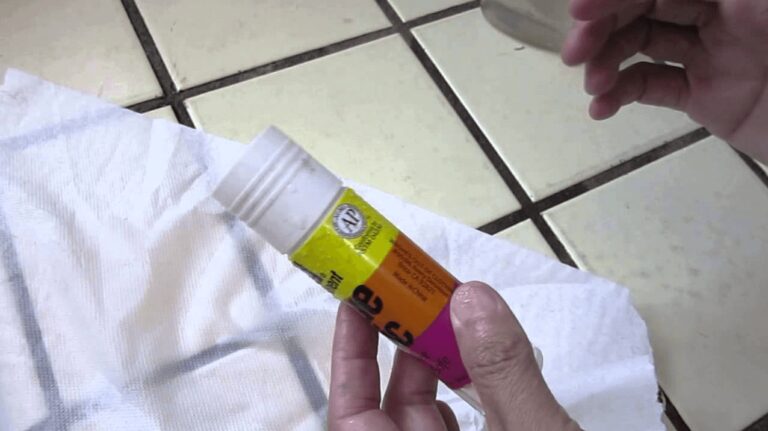
You are a GUI agent. You are given a task and a screenshot of the screen. Output one action in this format:
    pyautogui.click(x=<x>, y=<y>)
    Task: Click on the floor
    The height and width of the screenshot is (431, 768).
    Given the screenshot: What is the action you would take?
    372,114